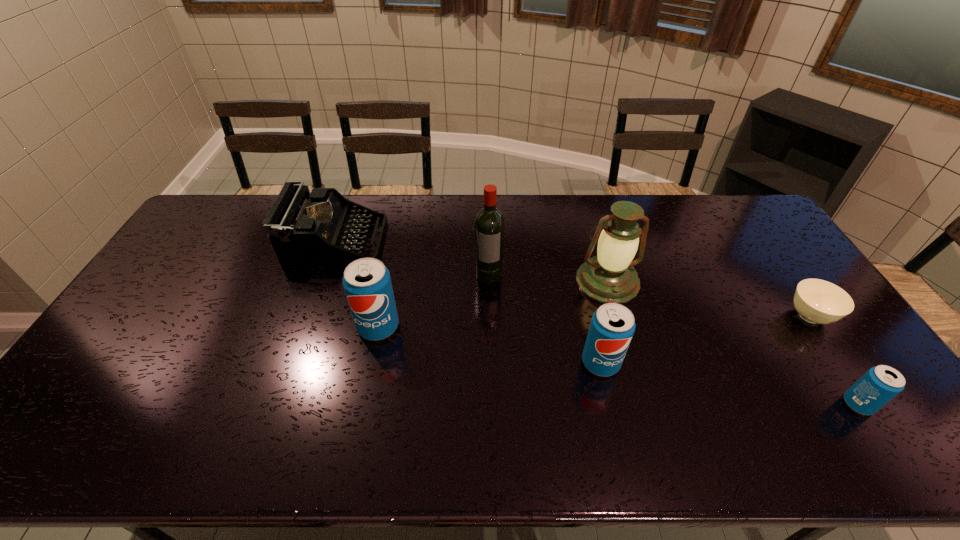
Given the evenly spaced soda cans in the image, where should an extra soda can be added on the left to preserve the spacing? Please point to a vacant space. Please provide its 2D coordinates. Your answer should be formatted as a tuple, i.e. [(x, y)], where the tuple contains the x and y coordinates of a point satisfying the conditions above.

[(184, 295)]